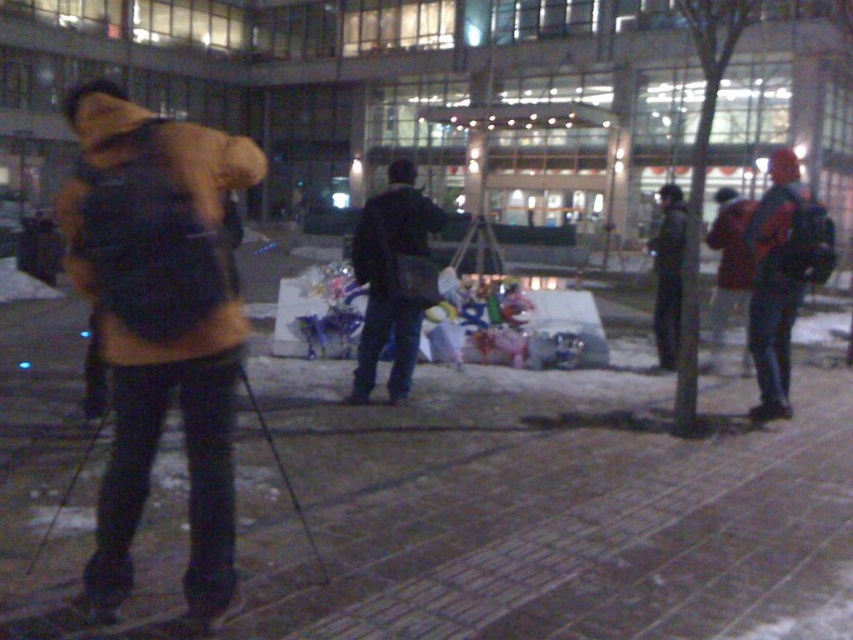
You are a photographer trying to capture a group photo of the matte yellow jacket at left and the dark blue jeans at center. Since you want to ensure both subjects are in focus, you need to know which one is wider. Which object is wider?

The matte yellow jacket at left is wider than the dark blue jeans at center.

You are standing at the center of the paved area in the plaza. You want to find the matte yellow jacket at left. Based on the coordinates provided, in which direction should you look to locate it?

The matte yellow jacket at left is located at coordinates point (160, 321). Since you are at the center, you should look to the left side of the frame to locate it.